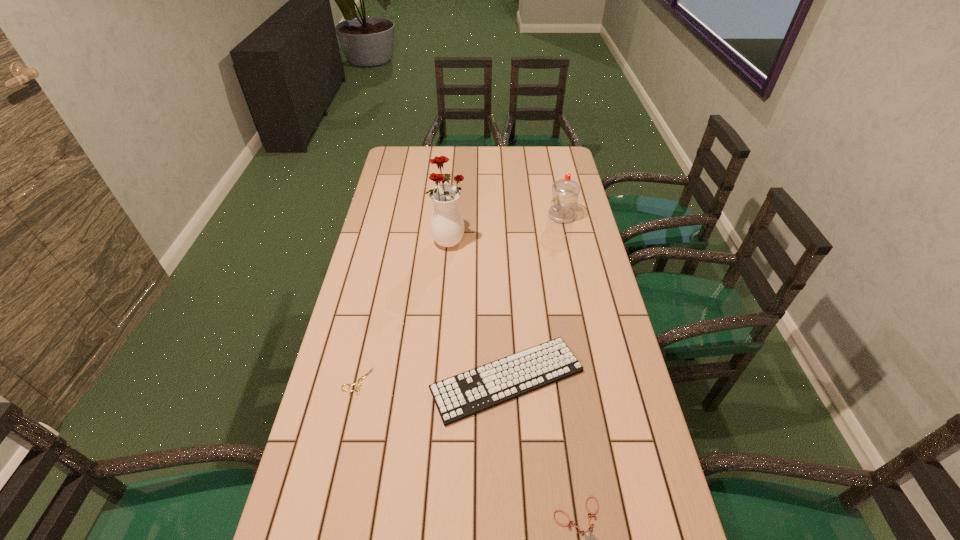
The height and width of the screenshot is (540, 960). I want to click on free space located on the handle side of the fourth shortest object, so click(x=462, y=216).

Identify the location of vacant area located 0.130m on the front of the third shortest object. The image size is (960, 540). (512, 478).

This screenshot has height=540, width=960. I want to click on free spot located 0.290m on the front of the leftmost object, so click(x=328, y=514).

Where is `object situated at the left edge`? The height and width of the screenshot is (540, 960). object situated at the left edge is located at coordinates (359, 380).

You are a GUI agent. You are given a task and a screenshot of the screen. Output one action in this format:
    pyautogui.click(x=<x>, y=<y>)
    Task: Click on the water bottle at the right edge
    Image resolution: width=960 pixels, height=540 pixels.
    Given the screenshot: What is the action you would take?
    pyautogui.click(x=565, y=192)

The height and width of the screenshot is (540, 960). Find the location of `computer keyboard that is at the right edge`. computer keyboard that is at the right edge is located at coordinates (458, 397).

Identify the location of vacant area at the far edge. The image size is (960, 540). (463, 156).

Locate an element on the screen. vacant region at the left edge is located at coordinates (386, 184).

You are a GUI agent. You are given a task and a screenshot of the screen. Output one action in this format:
    pyautogui.click(x=<x>, y=<y>)
    Task: Click on the vacant space at the right edge of the desktop
    
    Given the screenshot: What is the action you would take?
    pyautogui.click(x=579, y=260)

In the image, there is a desktop. Where is `free space at the far right corner`? free space at the far right corner is located at coordinates point(553,156).